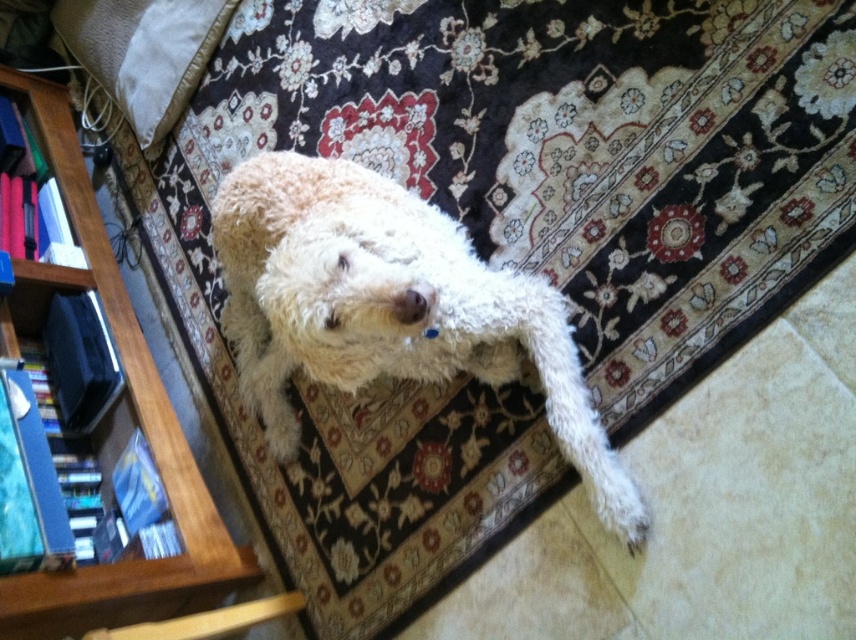
Between wooden bookshelf at left and soft beige pillow at upper left, which one has less height?

soft beige pillow at upper left

Is wooden bookshelf at left to the left of soft beige pillow at upper left from the viewer's perspective?

Yes, wooden bookshelf at left is to the left of soft beige pillow at upper left.

Find the location of a particular element. The height and width of the screenshot is (640, 856). wooden bookshelf at left is located at coordinates (128, 417).

Can you confirm if white fluffy dog at center is shorter than soft beige pillow at upper left?

No.

Can you confirm if white fluffy dog at center is bigger than soft beige pillow at upper left?

Correct, white fluffy dog at center is larger in size than soft beige pillow at upper left.

The width and height of the screenshot is (856, 640). I want to click on white fluffy dog at center, so click(390, 307).

Identify the location of white fluffy dog at center. This screenshot has height=640, width=856. (390, 307).

Which is more to the left, white fluffy dog at center or wooden bookshelf at left?

Positioned to the left is wooden bookshelf at left.

At what (x,y) coordinates should I click in order to perform the action: click on white fluffy dog at center. Please return your answer as a coordinate pair (x, y). The image size is (856, 640). Looking at the image, I should click on (390, 307).